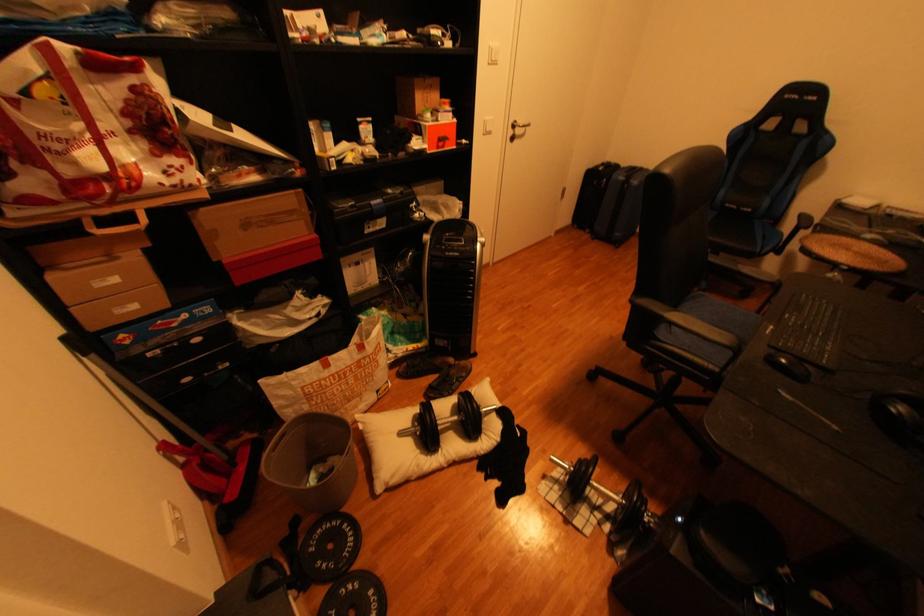
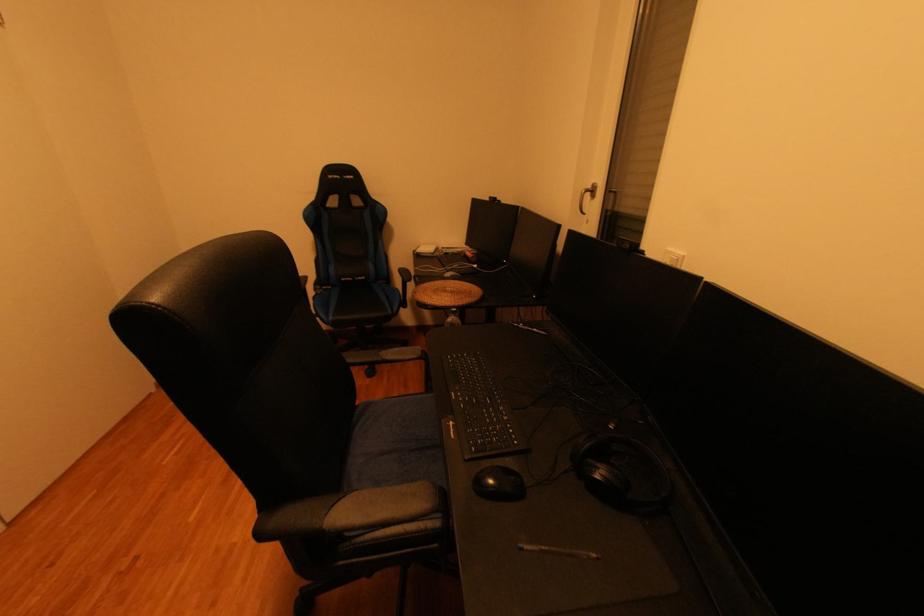
Question: The camera is either moving clockwise (left) or counter-clockwise (right) around the object. The first image is from the beginning of the video and the second image is from the end. Is the camera moving left or right when shooting the video?

Choices:
 (A) Left
 (B) Right

Answer: (A)